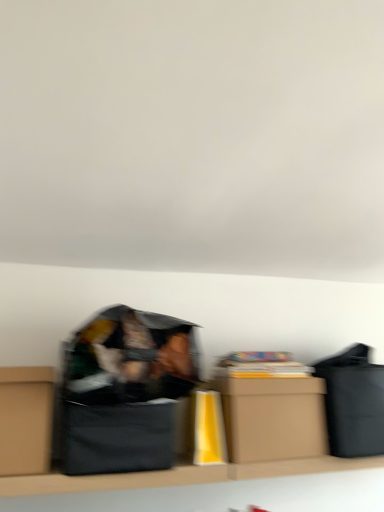
This screenshot has width=384, height=512. What do you see at coordinates (26, 420) in the screenshot? I see `brown cardboard box at left, which is the second box in right-to-left order` at bounding box center [26, 420].

Identify the location of brown cardboard box at left, which appears as the 1th box when viewed from the left. (26, 420).

In order to face black cardboard box at center, should I rotate leftwards or rightwards?

A 9.361 degree turn to the left will do.

Measure the distance between point (296,407) and camera.

Point (296,407) and camera are 4.84 feet apart.

Where is `brown cardboard box at left, which is the second box in right-to-left order`? This screenshot has height=512, width=384. brown cardboard box at left, which is the second box in right-to-left order is located at coordinates (26, 420).

Who is bigger, black cardboard box at center or brown cardboard box at center, the 2th box from the left?

Bigger between the two is brown cardboard box at center, the 2th box from the left.

From a real-world perspective, between black cardboard box at center and brown cardboard box at center, the 2th box from the left, who is vertically higher?

From a 3D spatial view, brown cardboard box at center, the 2th box from the left, is above.

Considering the points (148, 468) and (267, 441), which point is in front, point (148, 468) or point (267, 441)?

Point (148, 468)

Is black cardboard box at center far from brown cardboard box at center, the 1th box viewed from the right?

That's not correct — black cardboard box at center is a little close to brown cardboard box at center, the 1th box viewed from the right.

Choose the correct answer: Is brown cardboard box at center, the 2th box from the left, inside brown cardboard box at left, which is the second box in right-to-left order, or outside it?

brown cardboard box at center, the 2th box from the left, is not inside brown cardboard box at left, which is the second box in right-to-left order, it's outside.

Considering the sizes of objects brown cardboard box at center, the 2th box from the left, and brown cardboard box at left, which is the second box in right-to-left order, in the image provided, who is bigger, brown cardboard box at center, the 2th box from the left, or brown cardboard box at left, which is the second box in right-to-left order,?

With larger size is brown cardboard box at center, the 2th box from the left.

What's the angular difference between brown cardboard box at center, the 2th box from the left, and brown cardboard box at left, which is the second box in right-to-left order,'s facing directions?

The angle between the facing direction of brown cardboard box at center, the 2th box from the left, and the facing direction of brown cardboard box at left, which is the second box in right-to-left order, is 0.000275 degrees.

Is brown cardboard box at center, the 2th box from the left, oriented towards brown cardboard box at left, which is the second box in right-to-left order?

No, brown cardboard box at center, the 2th box from the left, is not facing towards brown cardboard box at left, which is the second box in right-to-left order.

Based on the photo, what's the angular difference between brown cardboard box at left, which appears as the 1th box when viewed from the left, and brown cardboard box at center, the 1th box viewed from the right,'s facing directions?

There is a 0.000275-degree angle between the facing directions of brown cardboard box at left, which appears as the 1th box when viewed from the left, and brown cardboard box at center, the 1th box viewed from the right.

Does brown cardboard box at left, which appears as the 1th box when viewed from the left, have a smaller size compared to brown cardboard box at center, the 1th box viewed from the right?

Yes, brown cardboard box at left, which appears as the 1th box when viewed from the left, is smaller than brown cardboard box at center, the 1th box viewed from the right.

Consider the image. Between brown cardboard box at left, which appears as the 1th box when viewed from the left, and brown cardboard box at center, the 1th box viewed from the right, which one has less height?

With less height is brown cardboard box at center, the 1th box viewed from the right.

Considering the positions of point (11, 373) and point (236, 434), is point (11, 373) closer or farther from the camera than point (236, 434)?

Point (11, 373) appears to be closer to the viewer than point (236, 434).

Between brown cardboard box at center, the 2th box from the left, and black cardboard box at center, which one appears on the right side from the viewer's perspective?

brown cardboard box at center, the 2th box from the left, is more to the right.

Does brown cardboard box at center, the 2th box from the left, have a smaller size compared to black cardboard box at center?

No.

Does point (310, 455) come behind point (95, 422)?

Yes, it is behind point (95, 422).

Is brown cardboard box at center, the 2th box from the left, located outside black cardboard box at center?

brown cardboard box at center, the 2th box from the left, is positioned outside black cardboard box at center.

Do you think brown cardboard box at left, which is the second box in right-to-left order, is within black cardboard box at center, or outside of it?

brown cardboard box at left, which is the second box in right-to-left order, is spatially situated outside black cardboard box at center.

Is brown cardboard box at left, which is the second box in right-to-left order, oriented away from black cardboard box at center?

No, brown cardboard box at left, which is the second box in right-to-left order, is not facing away from black cardboard box at center.

Looking at this image, considering the sizes of objects brown cardboard box at left, which appears as the 1th box when viewed from the left, and black cardboard box at center in the image provided, who is shorter, brown cardboard box at left, which appears as the 1th box when viewed from the left, or black cardboard box at center?

Standing shorter between the two is black cardboard box at center.

From the image's perspective, would you say brown cardboard box at left, which appears as the 1th box when viewed from the left, is positioned over black cardboard box at center?

Indeed, from the image's perspective, brown cardboard box at left, which appears as the 1th box when viewed from the left, is shown above black cardboard box at center.

From the image's perspective, does black cardboard box at center appear lower than brown cardboard box at left, which appears as the 1th box when viewed from the left?

Yes.

In the scene shown: Can you confirm if black cardboard box at center is bigger than brown cardboard box at left, which is the second box in right-to-left order?

Yes.

From a real-world perspective, is black cardboard box at center below brown cardboard box at left, which is the second box in right-to-left order?

Yes.

Is black cardboard box at center oriented away from brown cardboard box at left, which appears as the 1th box when viewed from the left?

No.

Where is `box behind the black cardboard box at center`? box behind the black cardboard box at center is located at coordinates (273, 417).

Where is `box on the left of brown cardboard box at center, the 2th box from the left`? The height and width of the screenshot is (512, 384). box on the left of brown cardboard box at center, the 2th box from the left is located at coordinates (26, 420).

From the image, which object appears to be nearer to brown cardboard box at center, the 1th box viewed from the right, brown cardboard box at left, which is the second box in right-to-left order, or black cardboard box at center?

black cardboard box at center is closer to brown cardboard box at center, the 1th box viewed from the right.

Looking at the image, which one is located further to black cardboard box at center, brown cardboard box at left, which is the second box in right-to-left order, or brown cardboard box at center, the 1th box viewed from the right?

brown cardboard box at center, the 1th box viewed from the right, is positioned further to the anchor black cardboard box at center.

Based on their spatial positions, is brown cardboard box at center, the 1th box viewed from the right, or brown cardboard box at left, which is the second box in right-to-left order, further from black cardboard box at center?

brown cardboard box at center, the 1th box viewed from the right, lies further to black cardboard box at center than the other object.

Estimate the real-world distances between objects in this image. Which object is closer to brown cardboard box at left, which appears as the 1th box when viewed from the left, black cardboard box at center or brown cardboard box at center, the 2th box from the left?

Among the two, black cardboard box at center is located nearer to brown cardboard box at left, which appears as the 1th box when viewed from the left.

Considering their positions, is brown cardboard box at center, the 1th box viewed from the right, positioned closer to brown cardboard box at left, which appears as the 1th box when viewed from the left, than black cardboard box at center?

The object closer to brown cardboard box at left, which appears as the 1th box when viewed from the left, is black cardboard box at center.

From the image, which object appears to be farther from brown cardboard box at center, the 2th box from the left, black cardboard box at center or brown cardboard box at left, which is the second box in right-to-left order?

brown cardboard box at left, which is the second box in right-to-left order, is positioned further to the anchor brown cardboard box at center, the 2th box from the left.

This screenshot has width=384, height=512. I want to click on cardboard box between brown cardboard box at left, which is the second box in right-to-left order, and brown cardboard box at center, the 1th box viewed from the right, in the horizontal direction, so click(x=115, y=437).